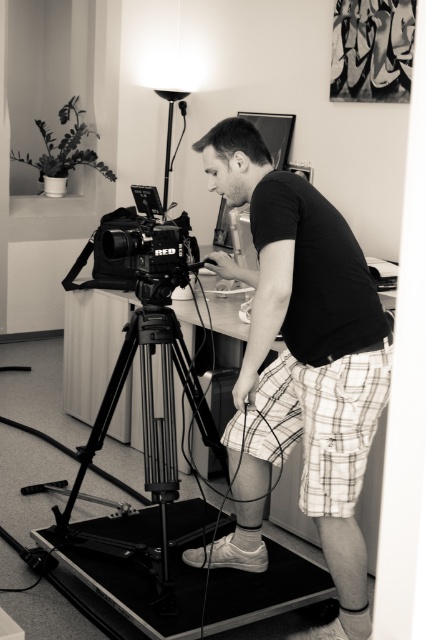
Question: Does black cotton t-shirt at center have a smaller size compared to white plaid shorts at center?

Choices:
 (A) yes
 (B) no

Answer: (B)

Question: Does white plaid shorts at center have a greater width compared to matte black camera at left?

Choices:
 (A) no
 (B) yes

Answer: (B)

Question: Which of the following is the farthest from the observer?

Choices:
 (A) black cotton t-shirt at center
 (B) black metal tripod at center
 (C) matte black camera at left

Answer: (C)

Question: Can you confirm if white plaid shorts at center is positioned to the right of black metal tripod at center?

Choices:
 (A) yes
 (B) no

Answer: (A)

Question: Which is nearer to the matte black camera at left?

Choices:
 (A) white plaid shorts at center
 (B) black metal tripod at center

Answer: (B)

Question: Which object is the closest to the black cotton t-shirt at center?

Choices:
 (A) matte black camera at left
 (B) black metal tripod at center
 (C) white plaid shorts at center

Answer: (C)